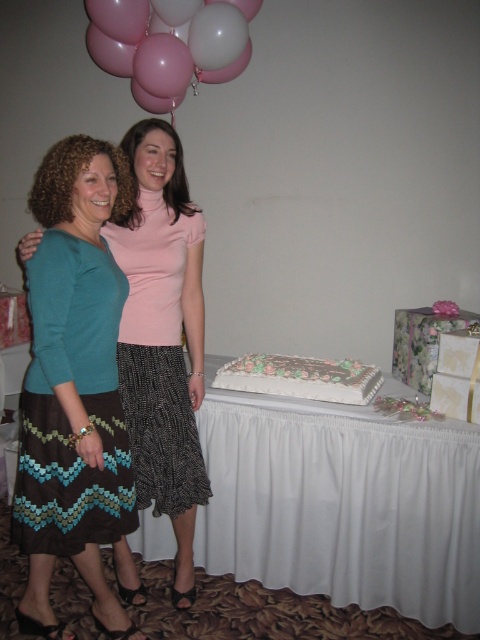
Question: Which point is closer to the camera?

Choices:
 (A) (124, 29)
 (B) (255, 374)
 (C) (165, 256)
 (D) (22, 396)

Answer: (D)

Question: Based on their relative distances, which object is nearer to the teal fabric skirt at left?

Choices:
 (A) white frosted cake at lower center
 (B) white matte balloon at upper center
 (C) brown zigzag skirt at left

Answer: (C)

Question: Which of these objects is positioned closest to the white matte balloon at upper center?

Choices:
 (A) brown zigzag skirt at left
 (B) teal fabric skirt at left
 (C) black textured dress at center

Answer: (B)

Question: Does brown zigzag skirt at left appear on the left side of pink glossy balloons at upper left?

Choices:
 (A) yes
 (B) no

Answer: (A)

Question: Can you confirm if brown zigzag skirt at left is positioned to the left of white matte balloon at upper center?

Choices:
 (A) yes
 (B) no

Answer: (A)

Question: Is brown zigzag skirt at left positioned behind white frosted cake at lower center?

Choices:
 (A) yes
 (B) no

Answer: (B)